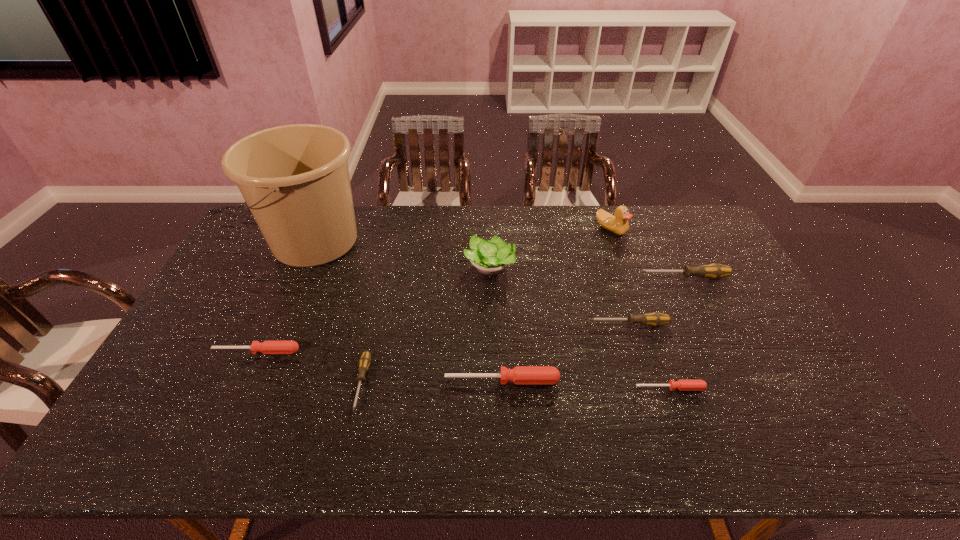
In order to click on free space that is in between the third object from left to right and the beige bucket in this screenshot , I will do `click(339, 312)`.

This screenshot has width=960, height=540. I want to click on unoccupied position between the second smallest red screwdriver and the fourth tallest object, so click(x=470, y=314).

Point out which object is positioned as the seventh nearest to the smallest gray screwdriver. Please provide its 2D coordinates. Your answer should be formatted as a tuple, i.e. [(x, y)], where the tuple contains the x and y coordinates of a point satisfying the conditions above.

[(714, 271)]

Image resolution: width=960 pixels, height=540 pixels. I want to click on the seventh closest object to the shortest screwdriver, so click(x=295, y=179).

Identify which screwdriver is the fifth nearest to the tallest screwdriver. Please provide its 2D coordinates. Your answer should be formatted as a tuple, i.e. [(x, y)], where the tuple contains the x and y coordinates of a point satisfying the conditions above.

[(267, 347)]

The image size is (960, 540). What are the coordinates of `the second closest screwdriver to the second nearest gray screwdriver` in the screenshot? It's located at (683, 385).

Locate an element on the screen. The height and width of the screenshot is (540, 960). gray screwdriver object that ranks as the third closest to the tallest object is located at coordinates (714, 271).

At what (x,y) coordinates should I click in order to perform the action: click on gray screwdriver identified as the second closest to the farthest red screwdriver. Please return your answer as a coordinate pair (x, y). Image resolution: width=960 pixels, height=540 pixels. Looking at the image, I should click on (x=656, y=319).

Identify the location of red screwdriver that is the second closest to the lettuce. (683, 385).

Where is `red screwdriver identified as the closest to the tallest object`? red screwdriver identified as the closest to the tallest object is located at coordinates (267, 347).